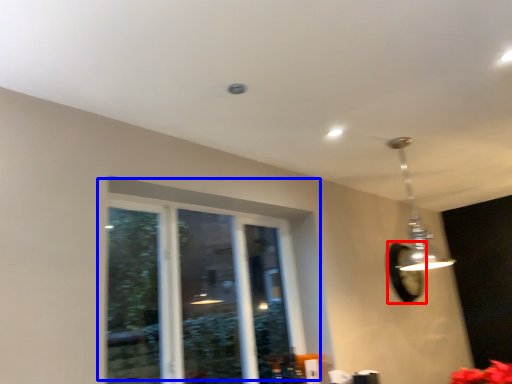
Question: Which object appears closest to the camera in this image, mirror (highlighted by a red box) or window (highlighted by a blue box)?

Choices:
 (A) mirror
 (B) window

Answer: (B)